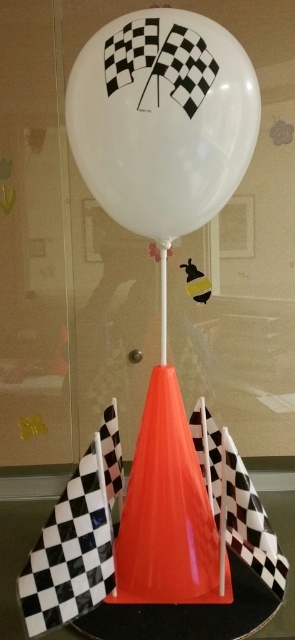
Can you confirm if white glossy balloon at center is positioned to the right of matte plastic pole at center?

Correct, you'll find white glossy balloon at center to the right of matte plastic pole at center.

Which is in front, point (204, 60) or point (161, 310)?

Positioned in front is point (204, 60).

Measure the distance between point [149,32] and camera.

A distance of 27.48 inches exists between point [149,32] and camera.

What are the coordinates of `white glossy balloon at center` in the screenshot? It's located at (161, 120).

Does white glossy balloon at center have a smaller size compared to orange glossy traffic cone at center?

No.

This screenshot has width=295, height=640. Identify the location of white glossy balloon at center. (161, 120).

Image resolution: width=295 pixels, height=640 pixels. Identify the location of white glossy balloon at center. (161, 120).

Is orange glossy traffic cone at center thinner than glossy plastic cone at center?

Correct, orange glossy traffic cone at center's width is less than glossy plastic cone at center's.

Between point (159, 568) and point (282, 513), which one is positioned in front?

Positioned in front is point (159, 568).

This screenshot has height=640, width=295. What do you see at coordinates (166, 512) in the screenshot?
I see `orange glossy traffic cone at center` at bounding box center [166, 512].

Locate an element on the screen. orange glossy traffic cone at center is located at coordinates (166, 512).